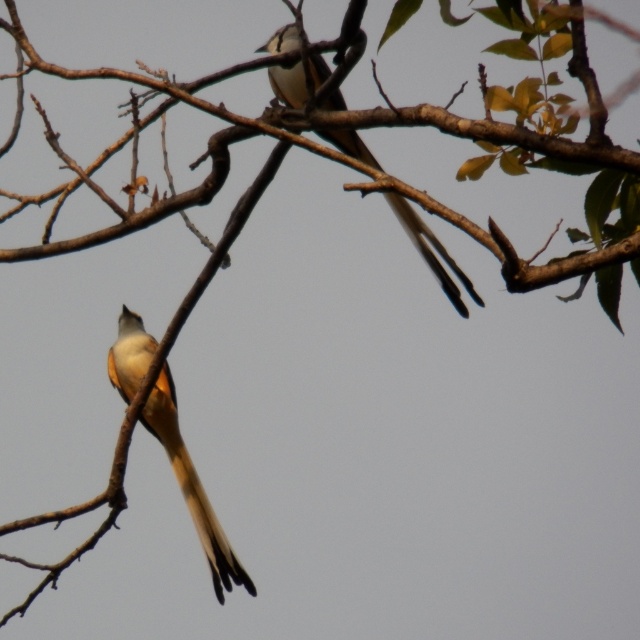
From the picture: Can you confirm if light brown feathered tail at lower left is positioned below white-feathered bird at upper center?

Yes.

Is point (124, 396) farther from camera compared to point (326, 138)?

Yes, point (124, 396) is farther from viewer.

Which is behind, point (132, 330) or point (292, 90)?

The point (132, 330) is behind.

Locate an element on the screen. light brown feathered tail at lower left is located at coordinates (192, 486).

Who is positioned more to the right, white-feathered bird at upper center or yellowish-brown feathered tail at lower center?

Positioned to the right is white-feathered bird at upper center.

Does white-feathered bird at upper center come in front of yellowish-brown feathered tail at lower center?

That is True.

Does point (291, 68) come in front of point (216, 579)?

Yes, point (291, 68) is closer to viewer.

Identify the location of white-feathered bird at upper center. (432, 252).

Can you confirm if light brown feathered tail at lower left is positioned above yellowish-brown feathered tail at lower center?

Yes, light brown feathered tail at lower left is above yellowish-brown feathered tail at lower center.

Does light brown feathered tail at lower left have a larger size compared to yellowish-brown feathered tail at lower center?

Yes.

What do you see at coordinates (192, 486) in the screenshot?
I see `light brown feathered tail at lower left` at bounding box center [192, 486].

Where is `light brown feathered tail at lower left`? light brown feathered tail at lower left is located at coordinates (192, 486).